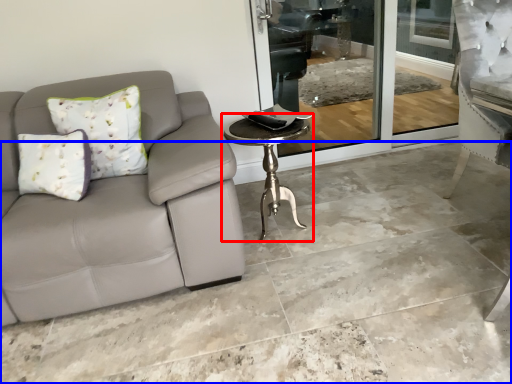
Question: Which object is further to the camera taking this photo, table (highlighted by a red box) or concrete (highlighted by a blue box)?

Choices:
 (A) table
 (B) concrete

Answer: (A)